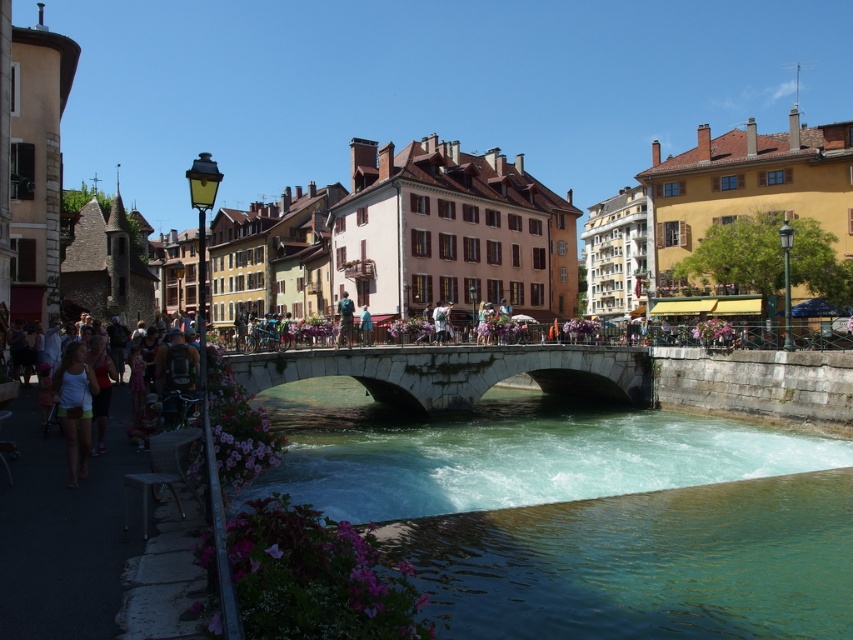
Does smooth stone bridge at center have a smaller size compared to stone bridge at center?

No, smooth stone bridge at center is not smaller than stone bridge at center.

Is point (212, 131) positioned behind point (251, 388)?

That is True.

Where is `smooth stone bridge at center`? smooth stone bridge at center is located at coordinates (428, 84).

Does white cotton shirt at lower left appear over blue fabric umbrella at center?

No, white cotton shirt at lower left is not above blue fabric umbrella at center.

Which is behind, point (18, 426) or point (360, 314)?

Positioned behind is point (360, 314).

Where is `white cotton shirt at lower left`? white cotton shirt at lower left is located at coordinates point(80,428).

Between smooth stone bridge at center and white cotton shirt at lower left, which one appears on the left side from the viewer's perspective?

white cotton shirt at lower left

Which is in front, point (242, 120) or point (65, 444)?

Point (65, 444)

At what (x,y) coordinates should I click in order to perform the action: click on smooth stone bridge at center. Please return your answer as a coordinate pair (x, y). Looking at the image, I should click on (428, 84).